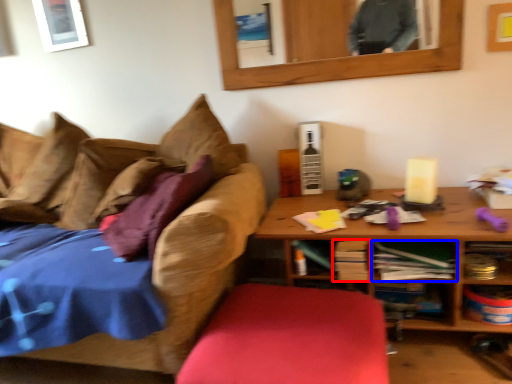
Question: Which object is closer to the camera taking this photo, book (highlighted by a red box) or book (highlighted by a blue box)?

Choices:
 (A) book
 (B) book

Answer: (B)